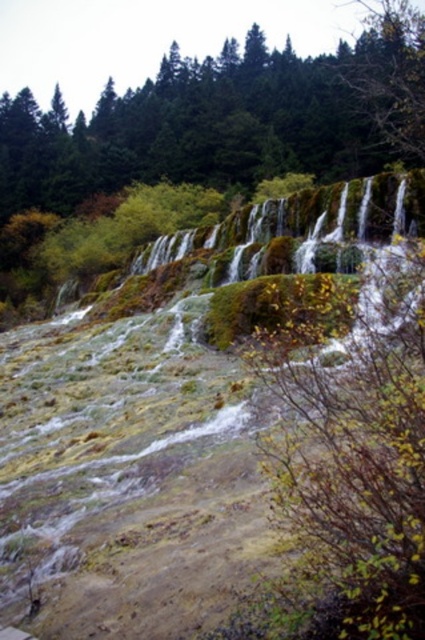
Question: Can you confirm if green mossy hillside at center is positioned to the left of green mossy rock at center?

Choices:
 (A) no
 (B) yes

Answer: (A)

Question: Which point is farther to the camera?

Choices:
 (A) click(2, 250)
 (B) click(36, 352)

Answer: (A)

Question: Which object appears farthest from the camera in this image?

Choices:
 (A) green mossy rock at center
 (B) green mossy hillside at center

Answer: (A)

Question: From the image, what is the correct spatial relationship of green mossy hillside at center in relation to green mossy rock at center?

Choices:
 (A) left
 (B) right

Answer: (B)

Question: Can you confirm if green mossy hillside at center is positioned to the left of green mossy rock at center?

Choices:
 (A) no
 (B) yes

Answer: (A)